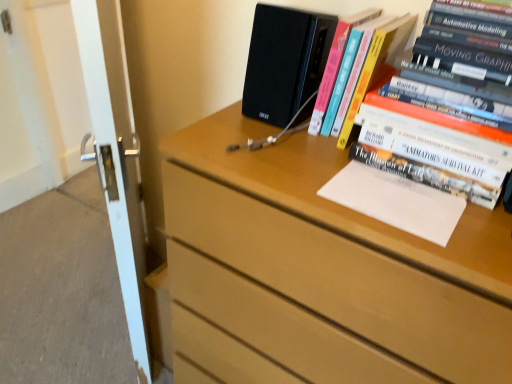
What are the coordinates of `free space to the back side of white paper at upper right` in the screenshot? It's located at (342, 148).